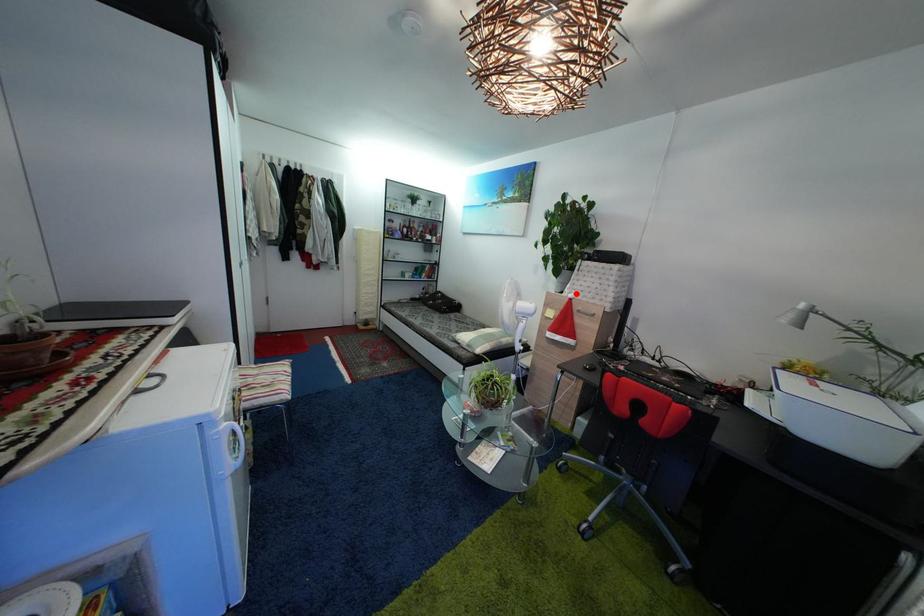
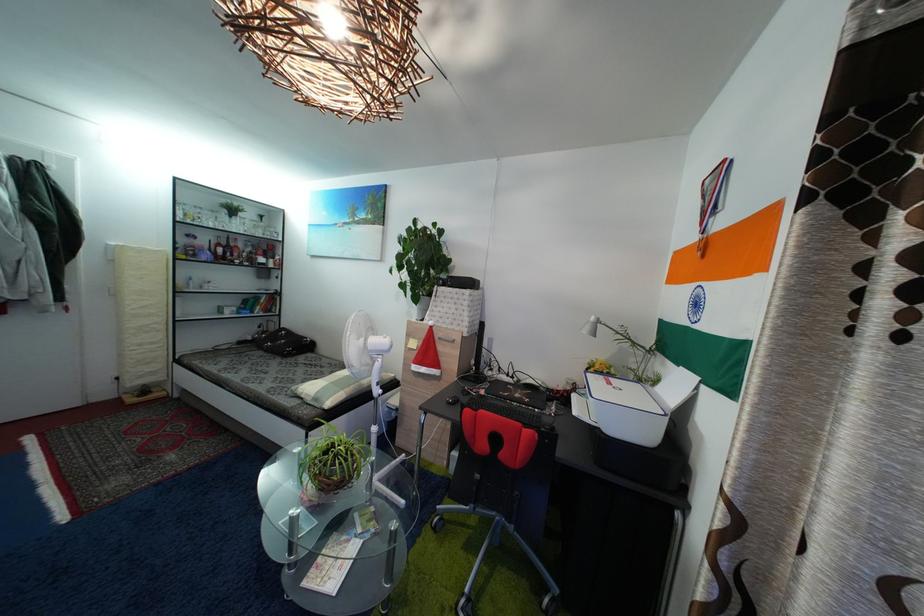
Question: I am providing you with two images of the same scene from different viewpoints. A red point is marked on the first image. Can you still see the location of the red point in image 2?

Choices:
 (A) Yes
 (B) No

Answer: (A)